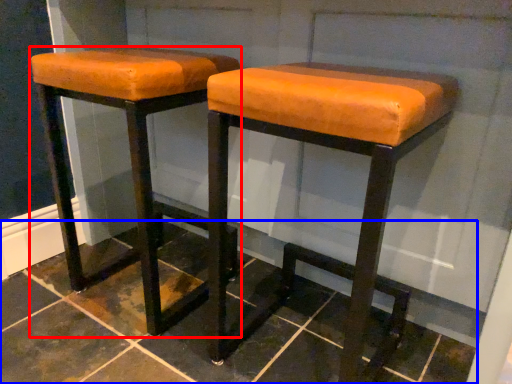
Question: Which of the following is the closest to the observer, stool (highlighted by a red box) or tile (highlighted by a blue box)?

Choices:
 (A) stool
 (B) tile

Answer: (B)